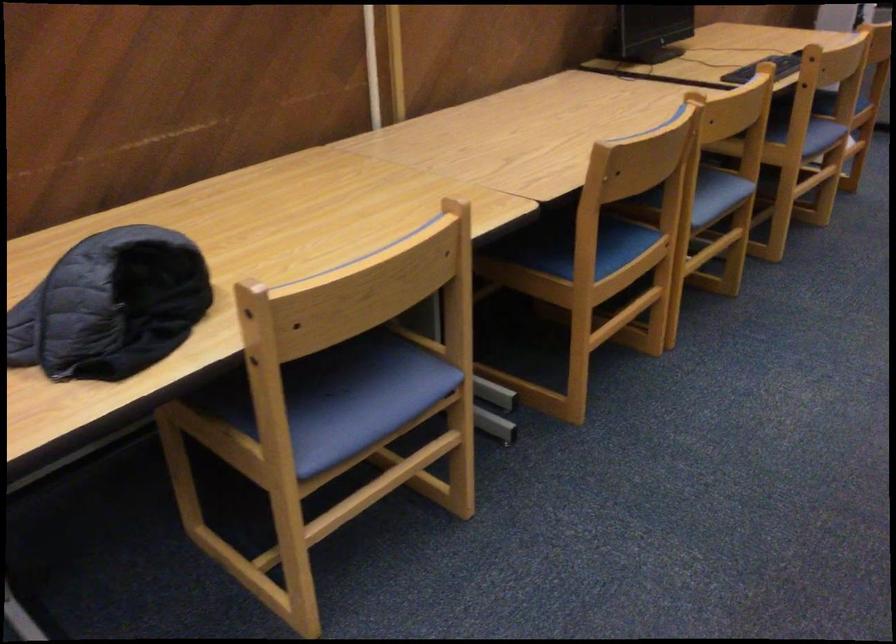
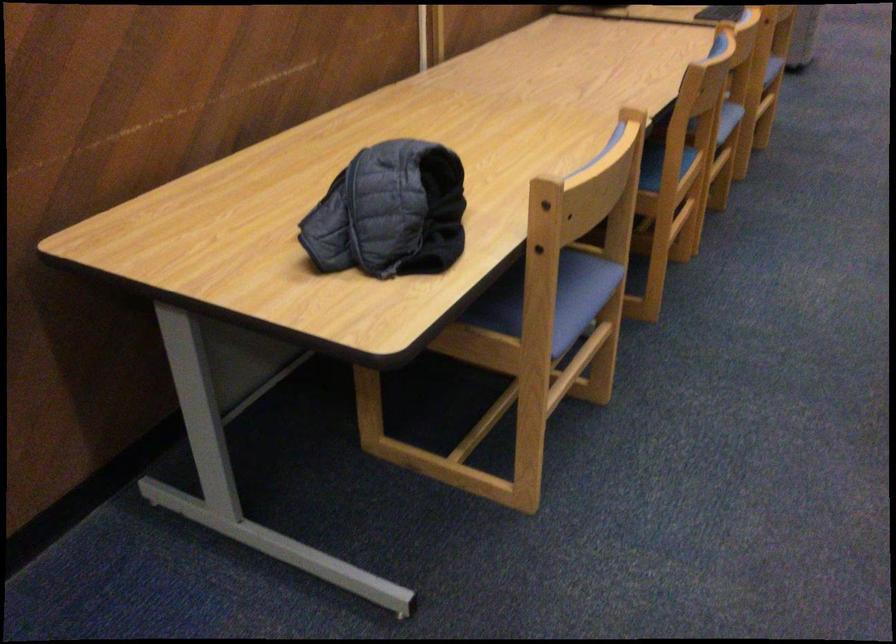
Where in the second image is the point corresponding to pixel 572 254 from the first image?

(660, 167)